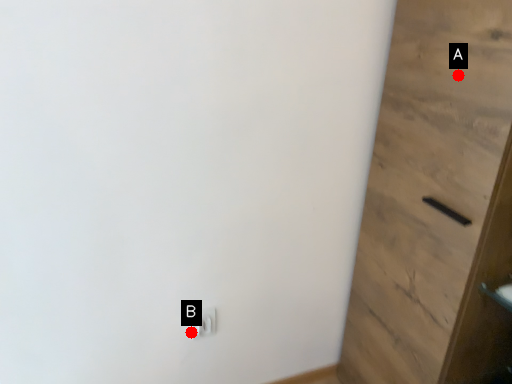
Question: Two points are circled on the image, labeled by A and B beside each circle. Which of the following is the closest to the observer?

Choices:
 (A) A is closer
 (B) B is closer

Answer: (A)